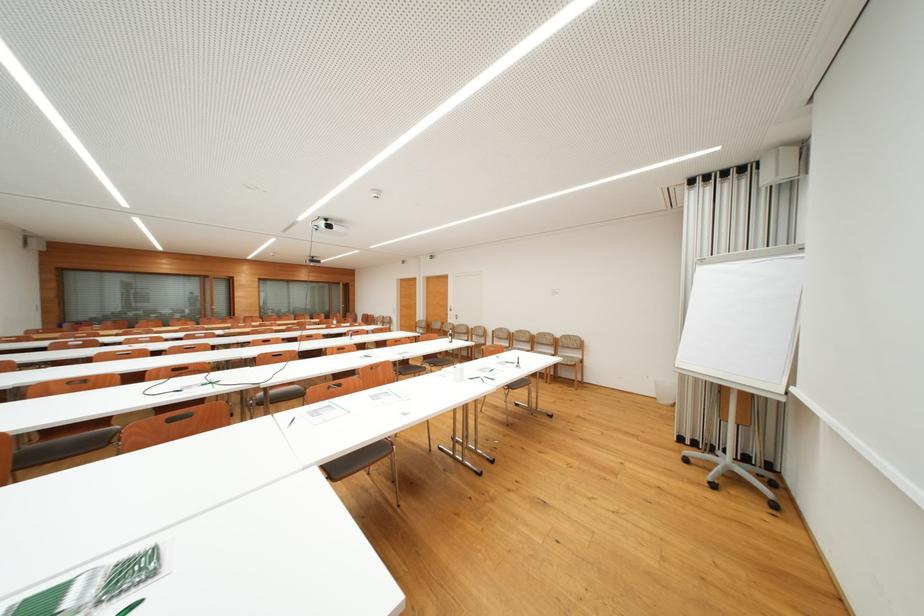
You are a GUI agent. You are given a task and a screenshot of the screen. Output one action in this format:
    pyautogui.click(x=<x>, y=<y>)
    Task: Click on the wooden chair sitting surface
    This screenshot has height=616, width=924.
    Given the screenshot: What is the action you would take?
    pyautogui.click(x=570, y=360)